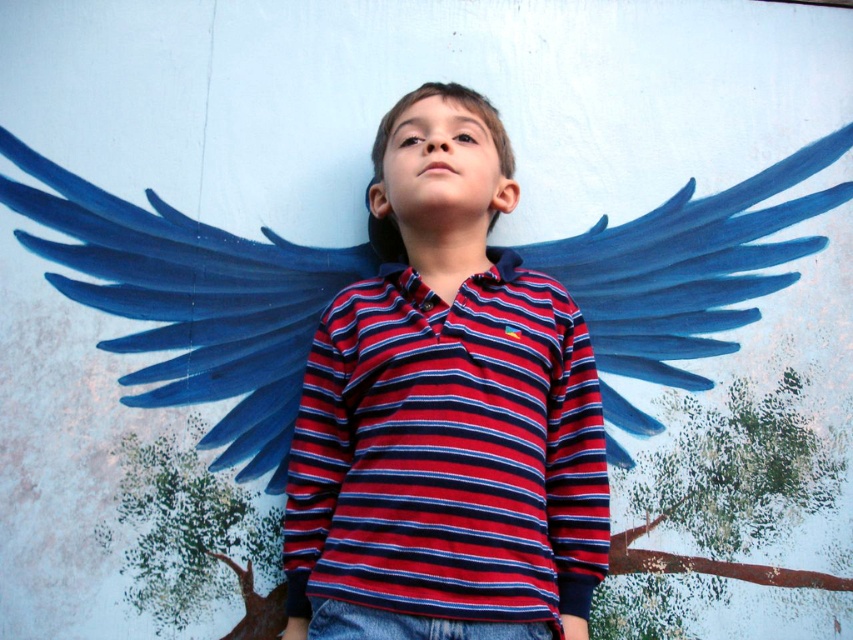
You are a photographer setting up a shoot in the described scene. You need to position a spotlight so that it illuminates the red striped shirt at center without affecting the blue matte wings at upper center. Based on their positions, is this possible?

Yes, since the red striped shirt at center is below the blue matte wings at upper center, you can angle the spotlight downward towards the shirt while keeping the light from reaching the upper area where the wings are located.

You are an artist observing the boy and the mural. You need to paint a new detail on the wall between the red striped shirt at center and the blue matte wings at upper center. Which object should you place your brush closer to?

The red striped shirt at center is to the right of the blue matte wings at upper center, so you should place your brush closer to the blue matte wings at upper center to paint between them.

You are a photographer trying to capture the boy in the image. You notice two points marked in the scene. The first point is at coordinate point(463,456) and the second is at point(769,244). Which point is closer to the camera?

Point(463,456) is in front of point(769,244), so it is closer to the camera.